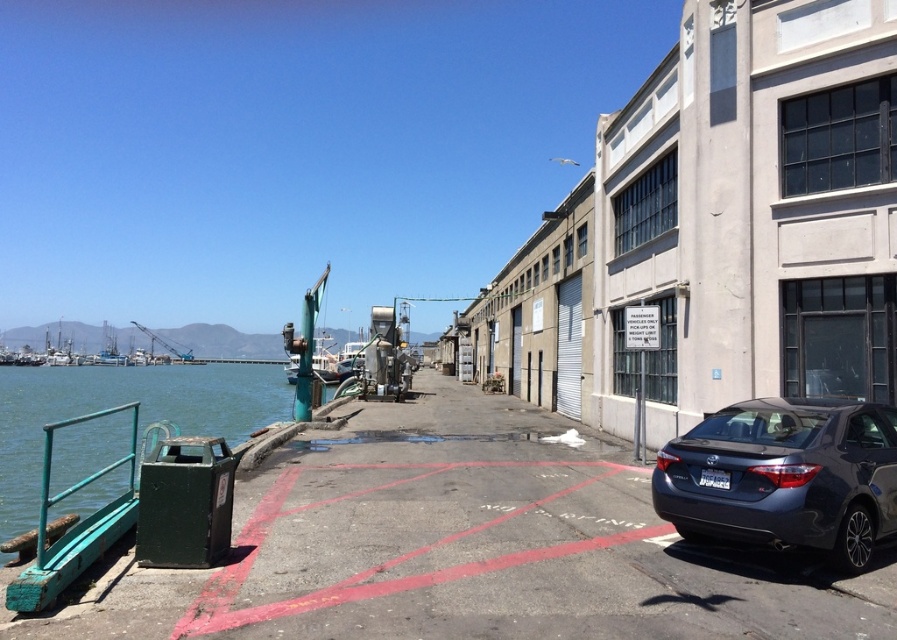
You are a delivery driver who needs to park your truck in the area shown. The truck is 2 meters wider than the satin dark gray sedan at lower right. According to the scene, can you park your truck in the no parking zone marked by the red lines without overlapping the green metallic water at left?

The satin dark gray sedan at lower right has a smaller size compared to green metallic water at left. Since the truck is 2 meters wider than the sedan, it may not fit in the no parking zone marked by the red lines without overlapping the green metallic water at left, as the sedan already occupies part of the space and the water area is likely narrower or positioned in a way that would cause overlap.

You are a delivery person who needs to place a package on the green metallic water at left. Can you do this?

The green metallic water at left is a body of water, so you cannot place a package on it.